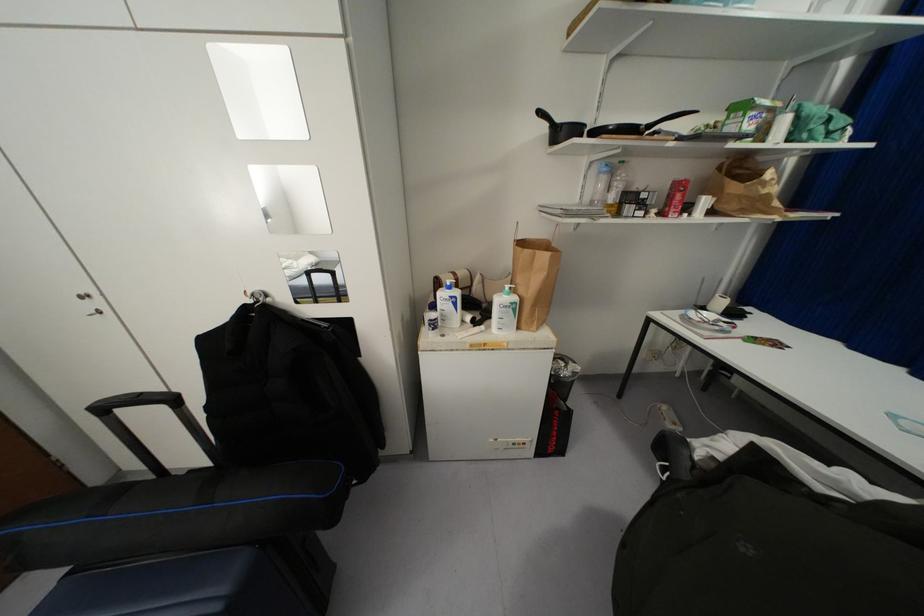
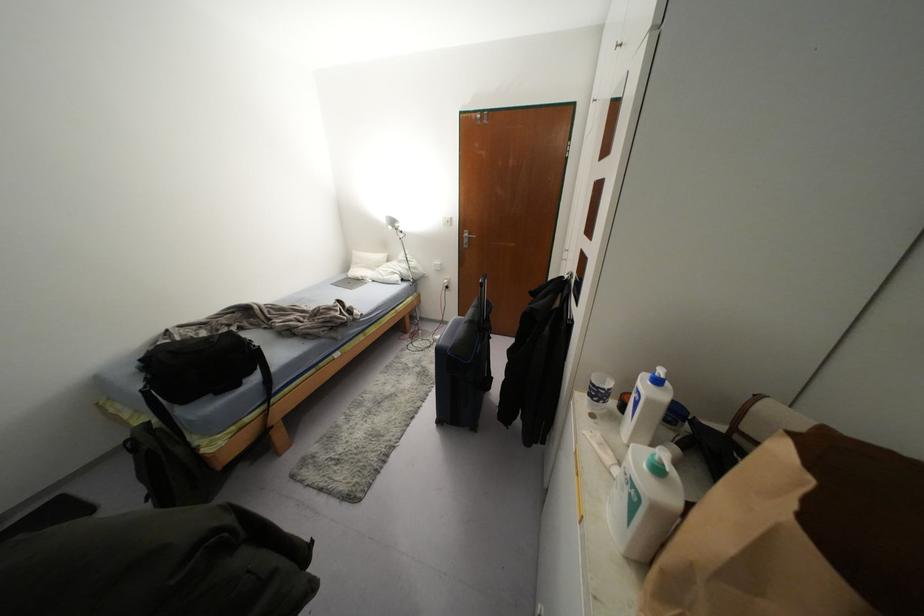
The point at (448, 286) is marked in the first image. Where is the corresponding point in the second image?

(658, 381)